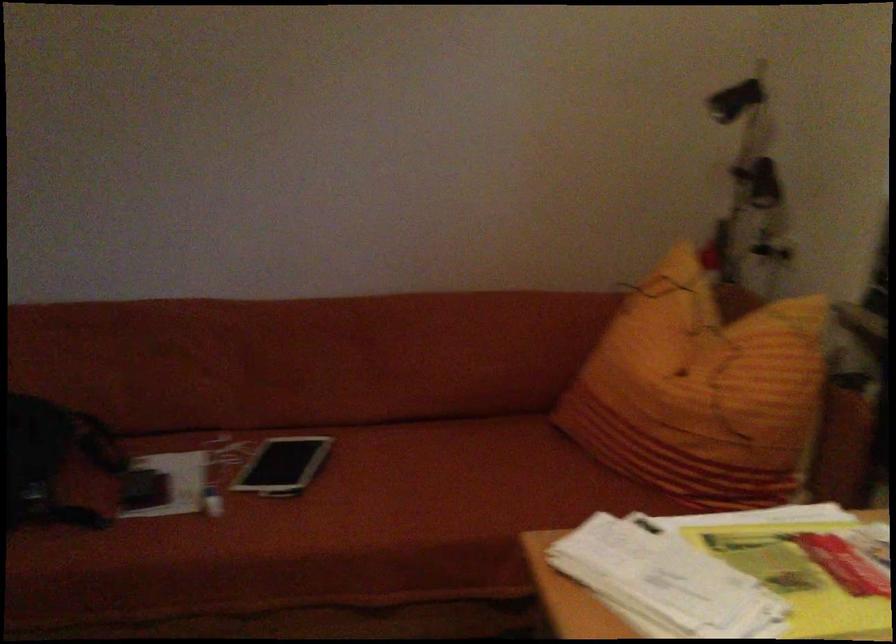
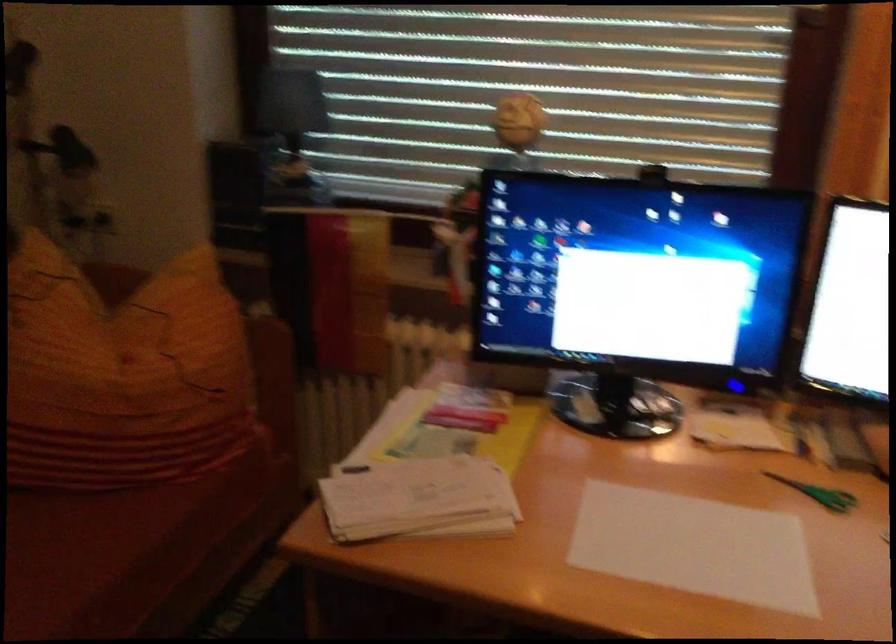
The point at (669, 377) is marked in the first image. Where is the corresponding point in the second image?

(122, 374)